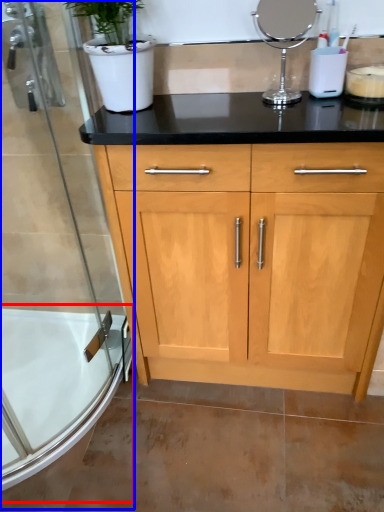
Question: Which point is closer to the camera, bath (highlighted by a red box) or shower door (highlighted by a blue box)?

Choices:
 (A) bath
 (B) shower door

Answer: (B)